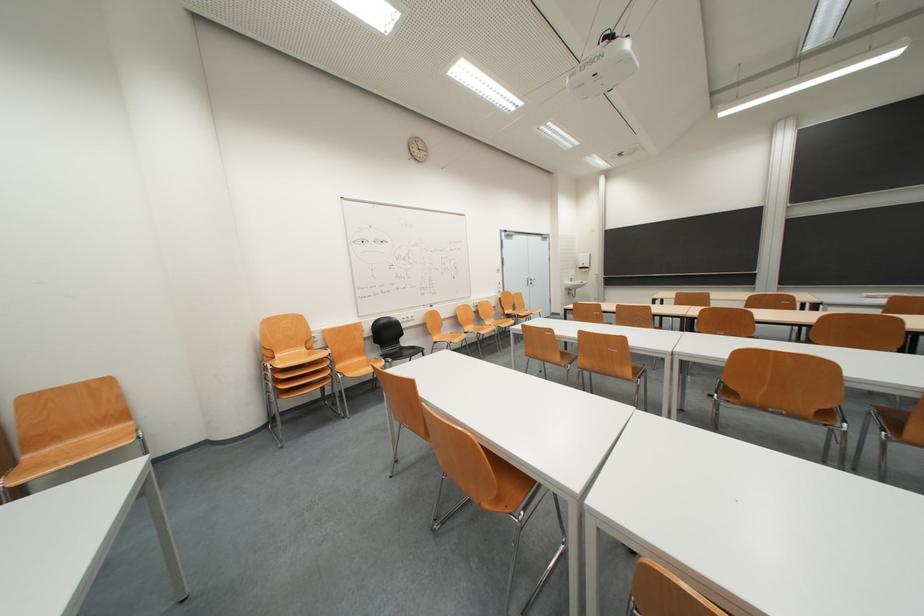
Locate an element on the screen. sink faucet lever is located at coordinates (574, 285).